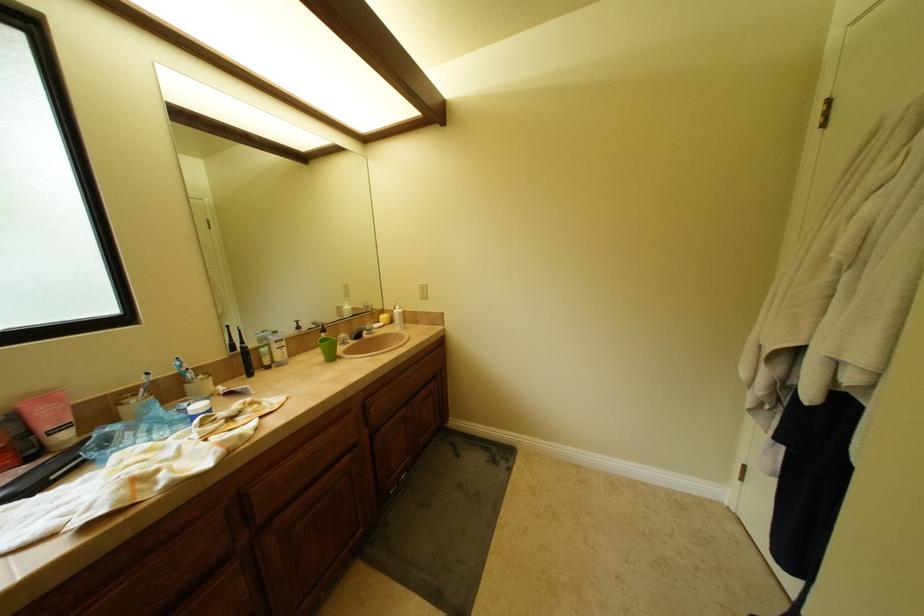
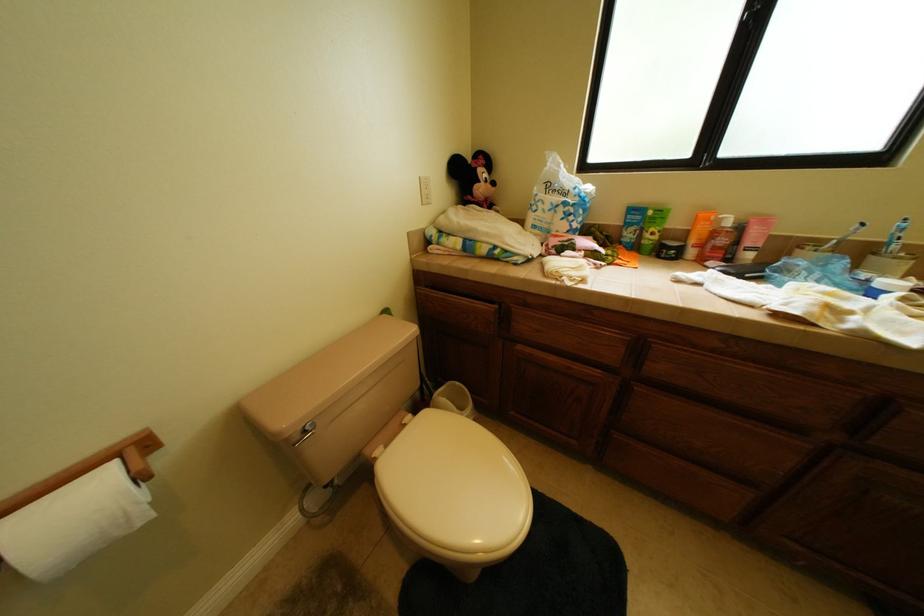
Consider the image. The first image is from the beginning of the video and the second image is from the end. How did the camera likely rotate when shooting the video?

The rotation direction of the camera is left-down.